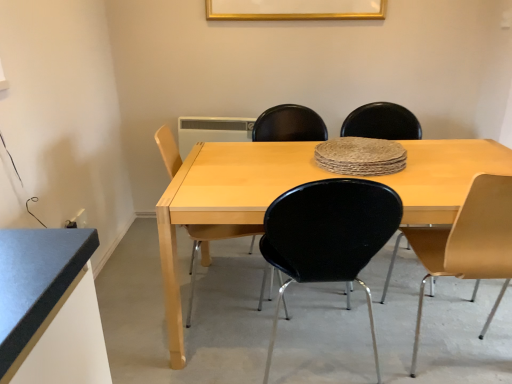
Question: Is matte yellow chair at right, placed as the first chair when sorted from right to left, positioned behind matte black chair at center, placed as the second chair when sorted from right to left?

Choices:
 (A) yes
 (B) no

Answer: (B)

Question: From the image's perspective, is matte yellow chair at right, placed as the first chair when sorted from right to left, above matte black chair at center, which is counted as the 3th chair, starting from the left?

Choices:
 (A) yes
 (B) no

Answer: (B)

Question: Would you say matte yellow chair at right, placed as the first chair when sorted from right to left, is a long distance from matte black chair at center, placed as the second chair when sorted from right to left?

Choices:
 (A) no
 (B) yes

Answer: (A)

Question: From a real-world perspective, is matte yellow chair at right, which appears as the 4th chair when viewed from the left, on matte black chair at center, placed as the second chair when sorted from right to left?

Choices:
 (A) no
 (B) yes

Answer: (A)

Question: Is matte yellow chair at right, placed as the first chair when sorted from right to left, taller than matte black chair at center, placed as the second chair when sorted from right to left?

Choices:
 (A) no
 (B) yes

Answer: (B)

Question: Does matte yellow chair at right, which appears as the 4th chair when viewed from the left, have a lesser height compared to matte black chair at center, placed as the second chair when sorted from right to left?

Choices:
 (A) no
 (B) yes

Answer: (A)

Question: Considering the relative sizes of white plastic radiator at upper center and gold metallic picture frame at upper center in the image provided, is white plastic radiator at upper center wider than gold metallic picture frame at upper center?

Choices:
 (A) no
 (B) yes

Answer: (B)

Question: Can you confirm if white plastic radiator at upper center is shorter than gold metallic picture frame at upper center?

Choices:
 (A) no
 (B) yes

Answer: (A)

Question: Is white plastic radiator at upper center next to gold metallic picture frame at upper center and touching it?

Choices:
 (A) yes
 (B) no

Answer: (B)

Question: Is white plastic radiator at upper center oriented towards gold metallic picture frame at upper center?

Choices:
 (A) no
 (B) yes

Answer: (A)

Question: Are white plastic radiator at upper center and gold metallic picture frame at upper center far apart?

Choices:
 (A) yes
 (B) no

Answer: (B)

Question: From a real-world perspective, is white plastic radiator at upper center physically below gold metallic picture frame at upper center?

Choices:
 (A) no
 (B) yes

Answer: (B)

Question: Considering the relative sizes of matte yellow chair at right, placed as the first chair when sorted from right to left, and light wood/black plastic chair at center, the 1th chair when ordered from left to right, in the image provided, is matte yellow chair at right, placed as the first chair when sorted from right to left, taller than light wood/black plastic chair at center, the 1th chair when ordered from left to right,?

Choices:
 (A) no
 (B) yes

Answer: (B)